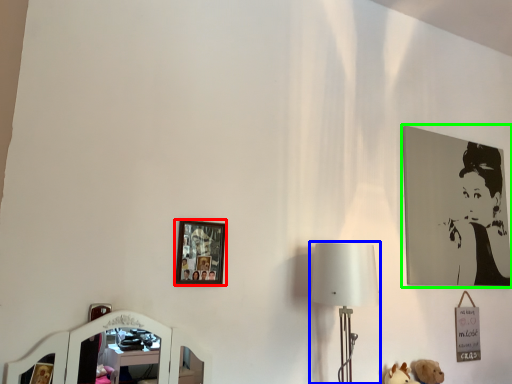
Question: Which is farther away from picture frame (highlighted by a red box)? table lamp (highlighted by a blue box) or picture frame (highlighted by a green box)?

Choices:
 (A) table lamp
 (B) picture frame

Answer: (B)